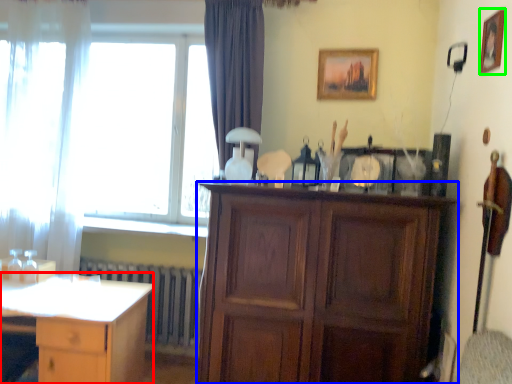
Question: Which is nearer to the desk (highlighted by a red box)? cabinetry (highlighted by a blue box) or picture frame (highlighted by a green box).

Choices:
 (A) cabinetry
 (B) picture frame

Answer: (A)